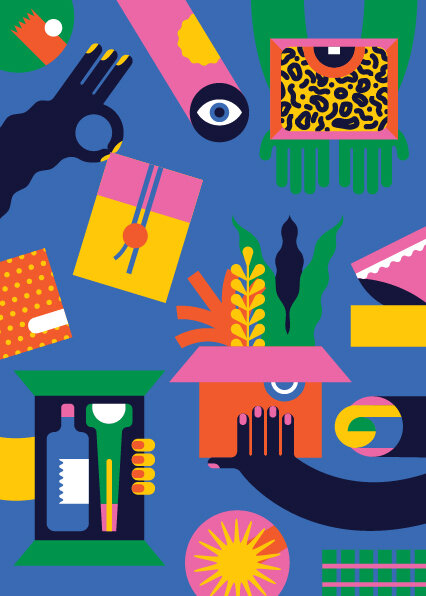
Locate an element on the screen. The width and height of the screenshot is (426, 596). green plants is located at coordinates (311, 291), (273, 322).